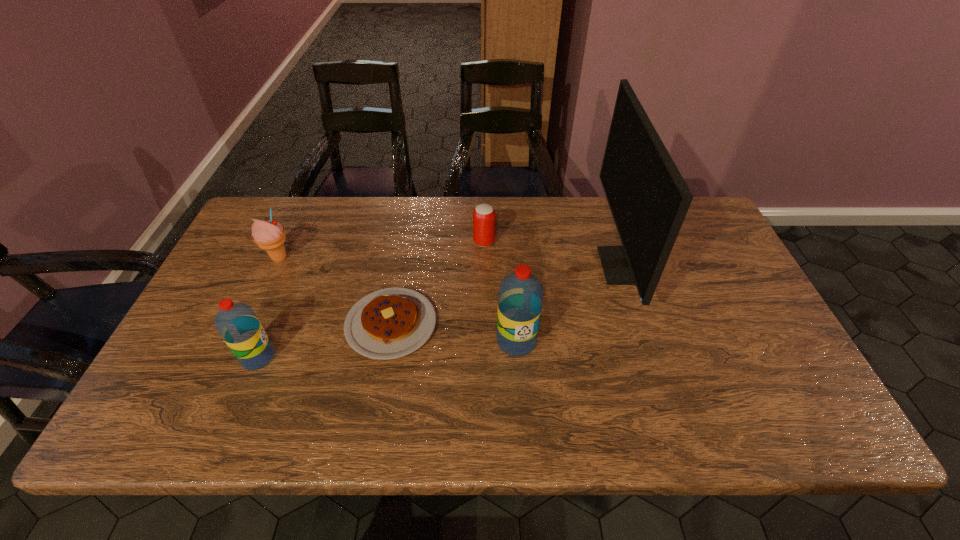
The height and width of the screenshot is (540, 960). Find the location of `free spot between the fifth tallest object and the computer monitor`. free spot between the fifth tallest object and the computer monitor is located at coordinates (554, 254).

At what (x,y) coordinates should I click in order to perform the action: click on free space between the computer monitor and the taller water bottle. Please return your answer as a coordinate pair (x, y). The width and height of the screenshot is (960, 540). Looking at the image, I should click on (570, 303).

Where is `unoccupied area between the third shortest object and the fourth object from right to left`? Image resolution: width=960 pixels, height=540 pixels. unoccupied area between the third shortest object and the fourth object from right to left is located at coordinates (335, 291).

Where is `vacant area between the second shortest object and the third object from left to right`? vacant area between the second shortest object and the third object from left to right is located at coordinates (438, 283).

You are a GUI agent. You are given a task and a screenshot of the screen. Output one action in this format:
    pyautogui.click(x=<x>, y=<y>)
    Task: Click on the free space between the rightmost object and the right water bottle
    
    Given the screenshot: What is the action you would take?
    pyautogui.click(x=570, y=303)

At what (x,y) coordinates should I click in order to perform the action: click on object that stands as the fourth closest to the icecream. Please return your answer as a coordinate pair (x, y). Image resolution: width=960 pixels, height=540 pixels. Looking at the image, I should click on (520, 298).

Identify the location of the closest object to the computer monitor. This screenshot has width=960, height=540. (520, 298).

At what (x,y) coordinates should I click in order to perform the action: click on free spot that satisfies the following two spatial constraints: 1. on the front side of the beer can; 2. on the front label of the third tallest object. Please return your answer as a coordinate pair (x, y). The width and height of the screenshot is (960, 540). Looking at the image, I should click on pyautogui.click(x=485, y=357).

Locate an element on the screen. The width and height of the screenshot is (960, 540). vacant point that satisfies the following two spatial constraints: 1. on the front side of the third object from left to right; 2. on the left side of the icecream is located at coordinates (250, 324).

This screenshot has height=540, width=960. I want to click on vacant space that satisfies the following two spatial constraints: 1. on the front label of the fifth shortest object; 2. on the front label of the left water bottle, so click(517, 357).